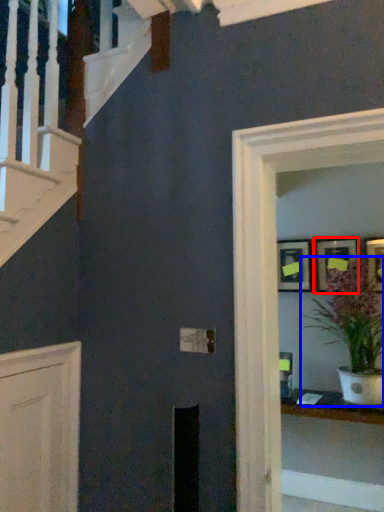
Question: Among these objects, which one is nearest to the camera, picture frame (highlighted by a red box) or houseplant (highlighted by a blue box)?

Choices:
 (A) picture frame
 (B) houseplant

Answer: (B)